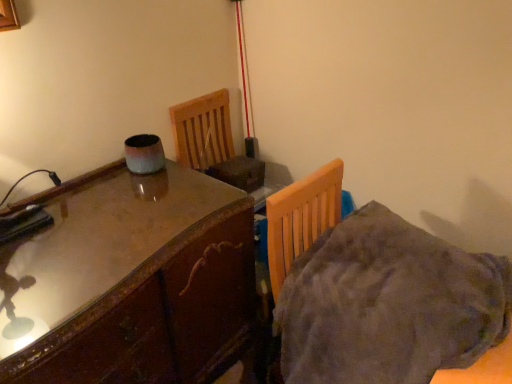
Question: From their relative heights in the image, would you say glossy wood table at left is taller or shorter than fuzzy gray blanket at lower right?

Choices:
 (A) short
 (B) tall

Answer: (B)

Question: In terms of width, does glossy wood table at left look wider or thinner when compared to fuzzy gray blanket at lower right?

Choices:
 (A) thin
 (B) wide

Answer: (B)

Question: Do you think glossy wood table at left is within fuzzy gray blanket at lower right, or outside of it?

Choices:
 (A) inside
 (B) outside

Answer: (B)

Question: Looking at their shapes, would you say fuzzy gray blanket at lower right is wider or thinner than glossy wood table at left?

Choices:
 (A) wide
 (B) thin

Answer: (B)

Question: Would you say fuzzy gray blanket at lower right is inside or outside glossy wood table at left?

Choices:
 (A) inside
 (B) outside

Answer: (B)

Question: Considering their positions, is fuzzy gray blanket at lower right located in front of or behind glossy wood table at left?

Choices:
 (A) front
 (B) behind

Answer: (A)

Question: Would you say fuzzy gray blanket at lower right is to the left or to the right of glossy wood table at left in the picture?

Choices:
 (A) left
 (B) right

Answer: (B)